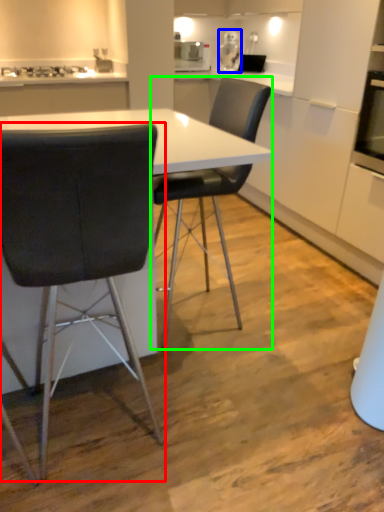
Question: Estimate the real-world distances between objects in this image. Which object is closer to chair (highlighted by a red box), appliance (highlighted by a blue box) or chair (highlighted by a green box)?

Choices:
 (A) appliance
 (B) chair

Answer: (B)